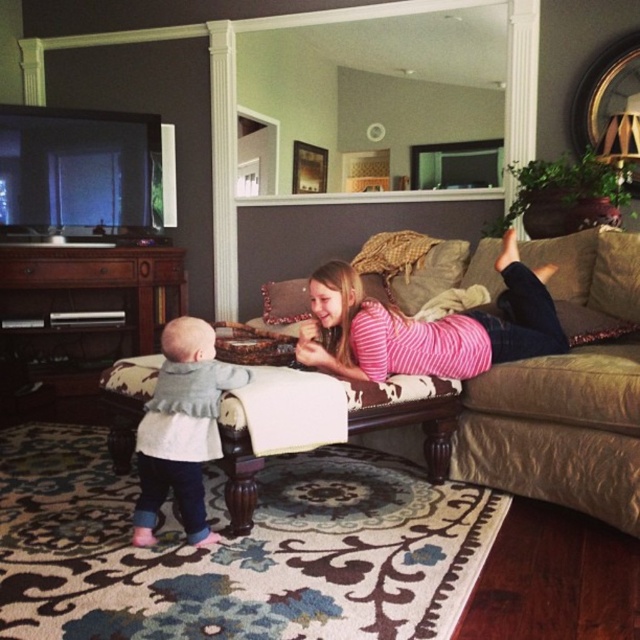
Question: Which object is the closest to the brown fabric couch at center?

Choices:
 (A) light gray knit sweater at center
 (B) pink striped shirt at center

Answer: (B)

Question: Which of the following is the closest to the observer?

Choices:
 (A) (161, 500)
 (B) (628, 458)
 (C) (358, 296)

Answer: (B)

Question: Is pink striped shirt at center closer to camera compared to light gray knit sweater at center?

Choices:
 (A) no
 (B) yes

Answer: (A)

Question: Where is brown fabric couch at center located in relation to light gray knit sweater at center in the image?

Choices:
 (A) above
 (B) below

Answer: (B)

Question: Can you confirm if brown fabric couch at center is thinner than pink striped shirt at center?

Choices:
 (A) no
 (B) yes

Answer: (B)

Question: Which of the following is the closest to the observer?

Choices:
 (A) (198, 408)
 (B) (465, 428)

Answer: (A)